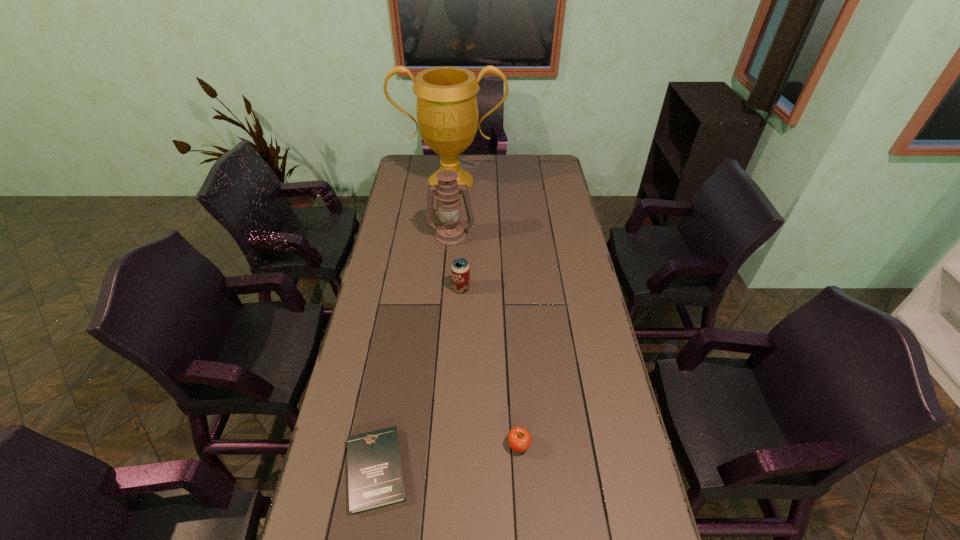
This screenshot has width=960, height=540. I want to click on trophy, so click(447, 114).

I want to click on the tallest object, so click(447, 114).

In order to click on the fourth nearest object in this screenshot , I will do `click(450, 232)`.

Image resolution: width=960 pixels, height=540 pixels. In order to click on the fourth shortest object in this screenshot , I will do `click(450, 232)`.

This screenshot has width=960, height=540. I want to click on the third farthest object, so click(460, 270).

Where is `beer can`? Image resolution: width=960 pixels, height=540 pixels. beer can is located at coordinates (460, 270).

The image size is (960, 540). In order to click on apple in this screenshot , I will do `click(519, 439)`.

The width and height of the screenshot is (960, 540). I want to click on book, so click(375, 477).

Where is `vacant space located on the engravings side of the tallest object`? This screenshot has width=960, height=540. vacant space located on the engravings side of the tallest object is located at coordinates (448, 209).

The height and width of the screenshot is (540, 960). I want to click on free spot located 0.120m on the left of the second tallest object, so click(398, 235).